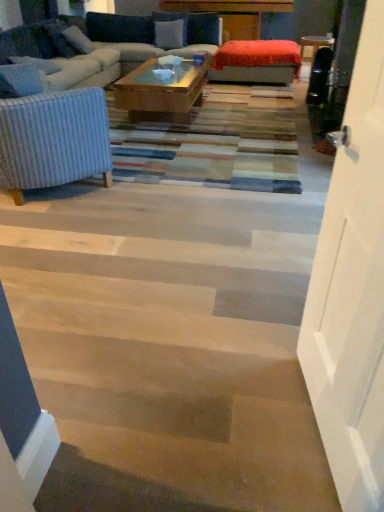
You are a GUI agent. You are given a task and a screenshot of the screen. Output one action in this format:
    pyautogui.click(x=<x>, y=<y>)
    Task: Click on the free space behind white wood door at right
    This screenshot has height=512, width=384.
    Given the screenshot: What is the action you would take?
    [x=252, y=338]